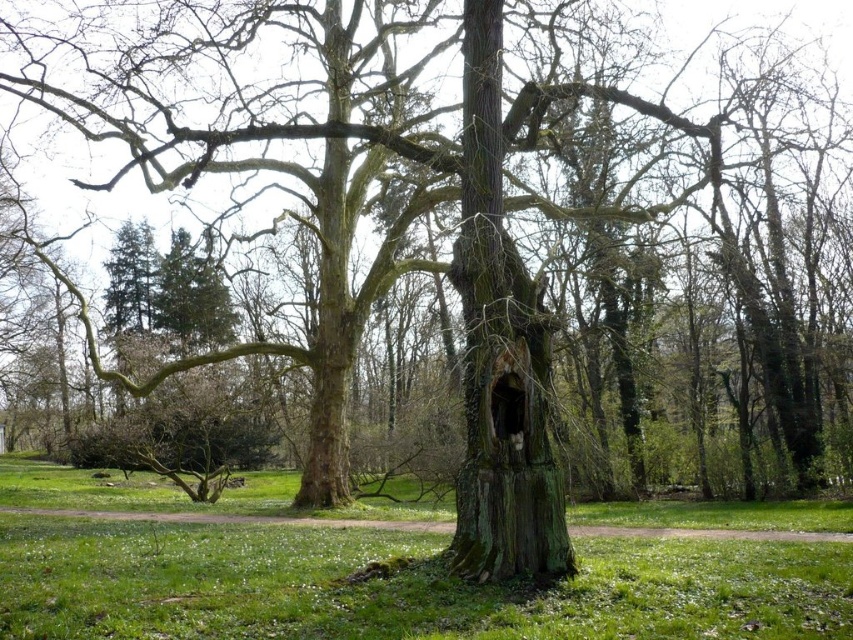
Who is positioned more to the right, green grass at center or green mossy tree trunk at center?

green mossy tree trunk at center

Locate an element on the screen. The height and width of the screenshot is (640, 853). green grass at center is located at coordinates (398, 584).

Describe the element at coordinates (398, 584) in the screenshot. I see `green grass at center` at that location.

This screenshot has height=640, width=853. I want to click on green grass at center, so click(x=398, y=584).